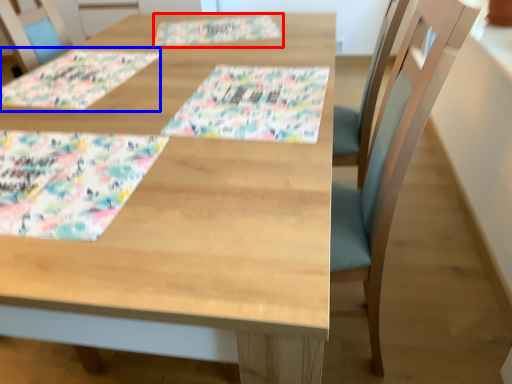
Question: Which object is closer to the camera taking this photo, place mat (highlighted by a red box) or place mat (highlighted by a blue box)?

Choices:
 (A) place mat
 (B) place mat

Answer: (B)